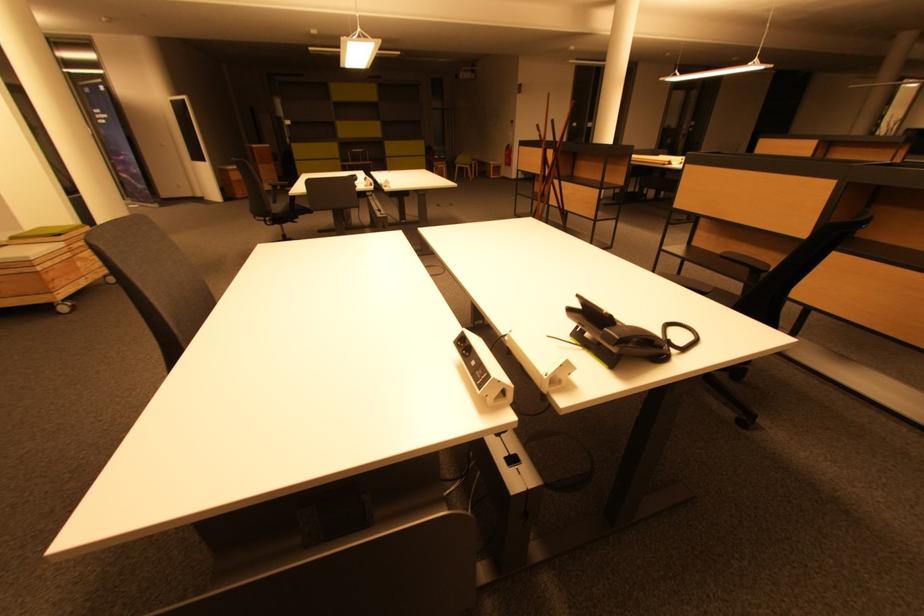
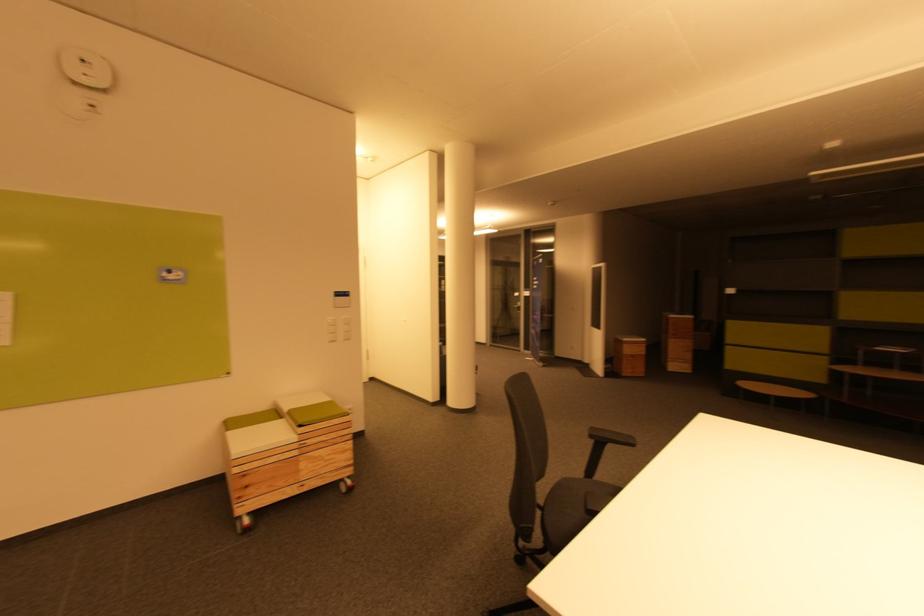
Find the pixel in the second image that matches (x=61, y=233) in the first image.

(305, 424)